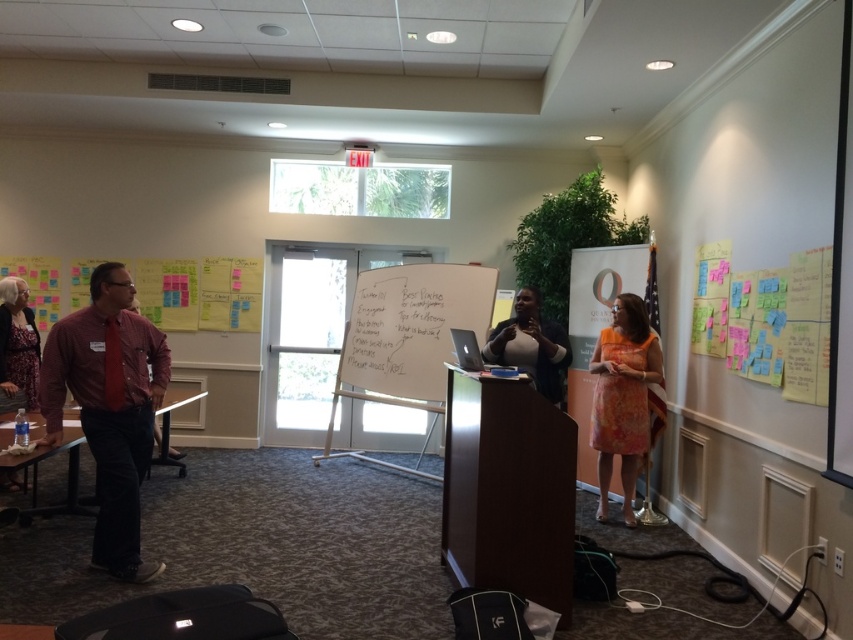
You are a presenter standing at the podium in the conference room. You need to walk to the whiteboard at center to write something. Considering the distance between you and the whiteboard, will you have to move past the orange floral dress at right to reach it?

The distance between the whiteboard at center and the orange floral dress at right is 1.54 meters. Since you are at the podium, which is in the foreground, you would need to move forward towards the whiteboard at center. The orange floral dress at right is positioned to the side, so you would not have to move past it to reach the whiteboard.